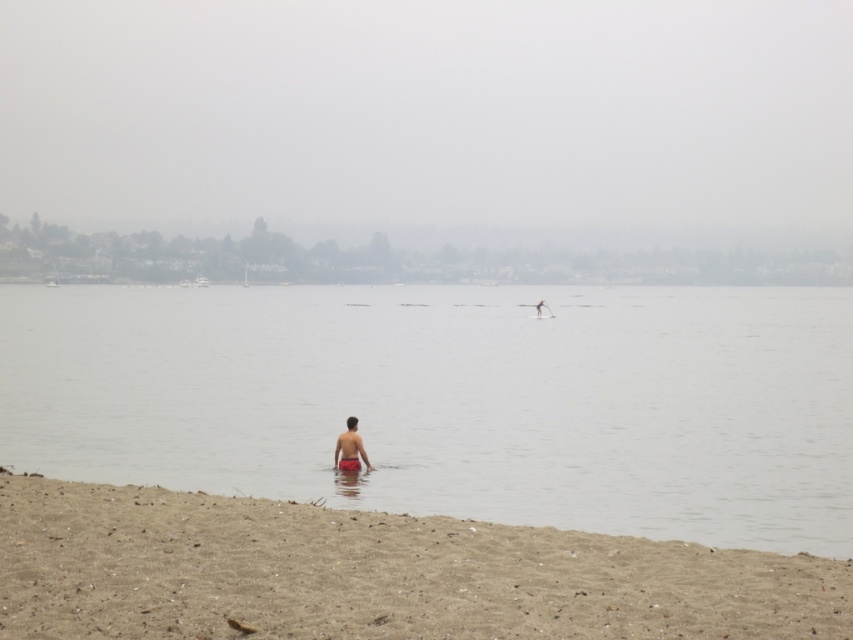
Is brown sandy beach at lower left shorter than reddish-orange swim trunks at center?

Indeed, brown sandy beach at lower left has a lesser height compared to reddish-orange swim trunks at center.

Which is above, brown sandy beach at lower left or reddish-orange swim trunks at center?

reddish-orange swim trunks at center is above.

Who is more forward, [579,564] or [343,444]?

Positioned in front is point [579,564].

Identify the location of brown sandy beach at lower left. (374, 573).

What do you see at coordinates (453, 401) in the screenshot?
I see `clear water at center` at bounding box center [453, 401].

Locate an element on the screen. clear water at center is located at coordinates (453, 401).

At what (x,y) coordinates should I click in order to perform the action: click on clear water at center. Please return your answer as a coordinate pair (x, y). Image resolution: width=853 pixels, height=640 pixels. Looking at the image, I should click on (453, 401).

Image resolution: width=853 pixels, height=640 pixels. Find the location of `clear water at center`. clear water at center is located at coordinates (453, 401).

Does clear water at center have a larger size compared to brown sandy beach at lower left?

Yes.

Does clear water at center have a lesser width compared to brown sandy beach at lower left?

Incorrect, clear water at center's width is not less than brown sandy beach at lower left's.

This screenshot has width=853, height=640. What do you see at coordinates (453, 401) in the screenshot? I see `clear water at center` at bounding box center [453, 401].

At what (x,y) coordinates should I click in order to perform the action: click on clear water at center. Please return your answer as a coordinate pair (x, y). This screenshot has width=853, height=640. Looking at the image, I should click on tap(453, 401).